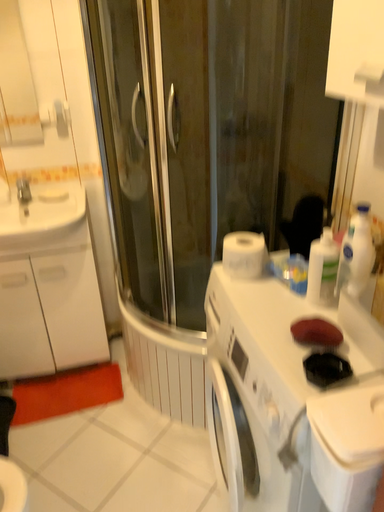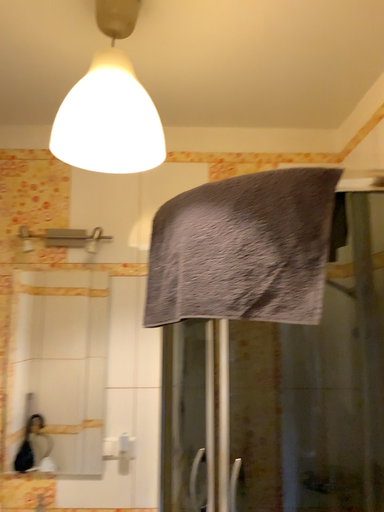
Question: How did the camera likely rotate when shooting the video?

Choices:
 (A) rotated left
 (B) rotated right

Answer: (A)